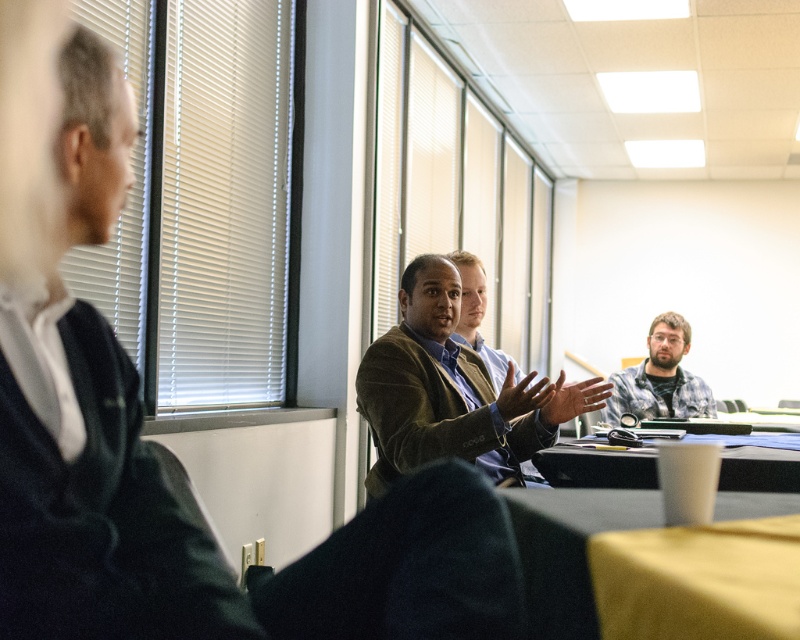
Question: Estimate the real-world distances between objects in this image. Which object is closer to the yellow fabric table at lower right?

Choices:
 (A) greenish-brown textured blazer at center
 (B) plaid shirt at center
 (C) velvet brown blazer at center
 (D) black plastic table at lower right

Answer: (A)

Question: Which object is the closest to the yellow fabric table at lower right?

Choices:
 (A) velvet brown blazer at center
 (B) black plastic table at lower right

Answer: (A)

Question: Does yellow fabric table at lower right have a greater width compared to black plastic table at lower right?

Choices:
 (A) no
 (B) yes

Answer: (A)

Question: Does yellow fabric table at lower right have a smaller size compared to black plastic table at lower right?

Choices:
 (A) yes
 (B) no

Answer: (A)

Question: Considering the relative positions of greenish-brown textured blazer at center and velvet brown blazer at center in the image provided, where is greenish-brown textured blazer at center located with respect to velvet brown blazer at center?

Choices:
 (A) above
 (B) below

Answer: (A)

Question: Which object is positioned farthest from the plaid shirt at center?

Choices:
 (A) yellow fabric table at lower right
 (B) velvet brown blazer at center
 (C) black plastic table at lower right

Answer: (A)